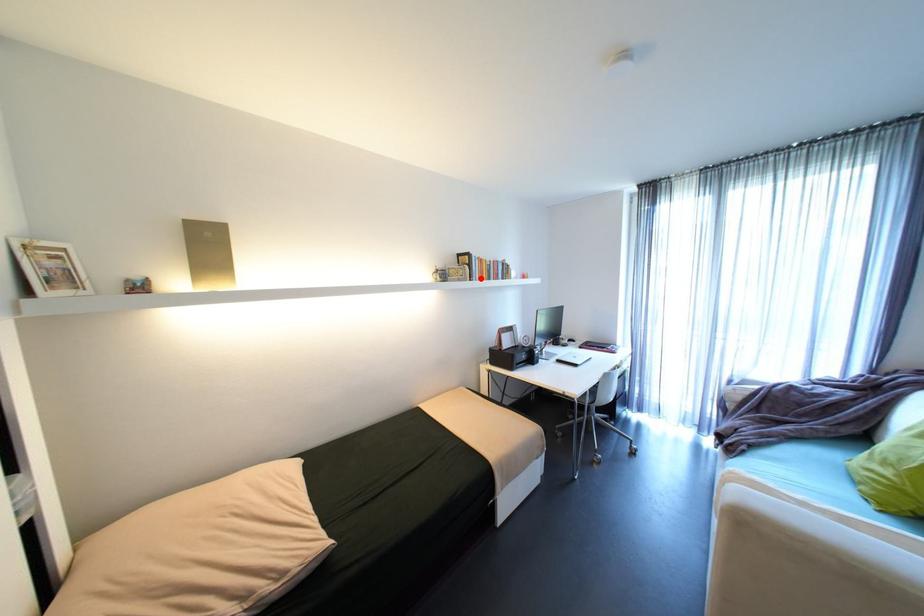
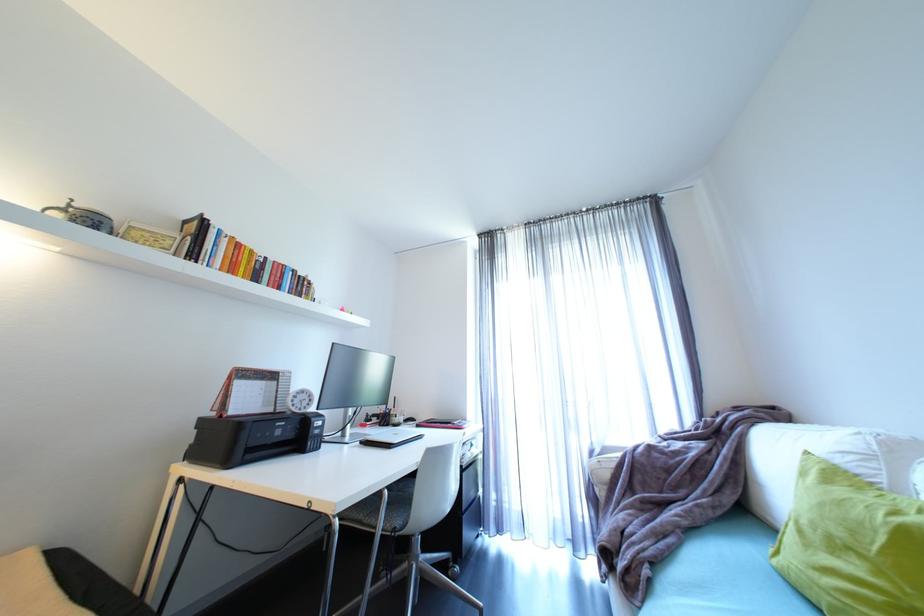
Locate, in the second image, the point that corresponds to the highlighted location in the first image.

(208, 262)